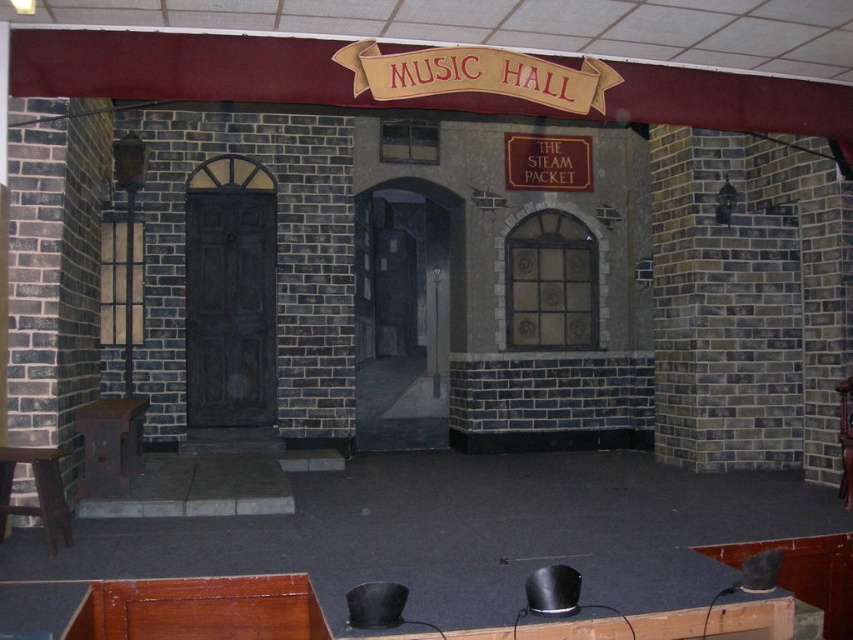
Does smooth wooden floor at center have a greater width compared to rustic wood stool at lower left?

Yes, smooth wooden floor at center is wider than rustic wood stool at lower left.

Between smooth wooden floor at center and rustic wood stool at lower left, which one has more height?

With more height is rustic wood stool at lower left.

The height and width of the screenshot is (640, 853). What are the coordinates of `smooth wooden floor at center` in the screenshot? It's located at (465, 532).

Is point (86, 484) in front of point (849, 451)?

Yes, it is in front of point (849, 451).

What do you see at coordinates (109, 444) in the screenshot? I see `rustic wood stool at lower left` at bounding box center [109, 444].

You are a GUI agent. You are given a task and a screenshot of the screen. Output one action in this format:
    pyautogui.click(x=<x>, y=<y>)
    Task: Click on the rustic wood stool at lower left
    
    Given the screenshot: What is the action you would take?
    pyautogui.click(x=109, y=444)

Can you confirm if smooth wooden floor at center is positioned to the left of wooden stool at center?

Indeed, smooth wooden floor at center is positioned on the left side of wooden stool at center.

Can you confirm if smooth wooden floor at center is positioned below wooden stool at center?

Correct, smooth wooden floor at center is located below wooden stool at center.

Who is more forward, (28, 538) or (842, 488)?

Point (28, 538) is more forward.

Locate an element on the screen. smooth wooden floor at center is located at coordinates (465, 532).